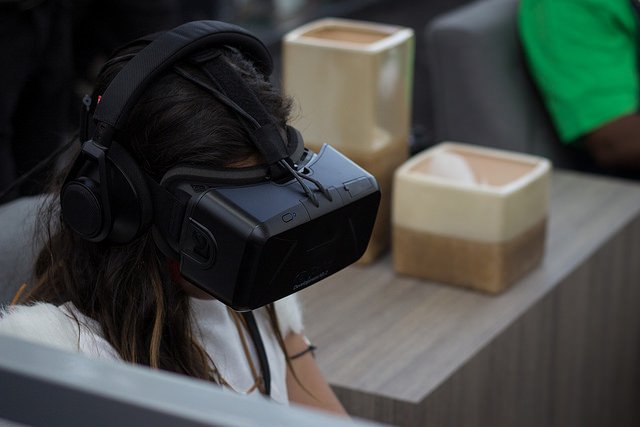
Identify the location of side table. The height and width of the screenshot is (427, 640). (420, 344).